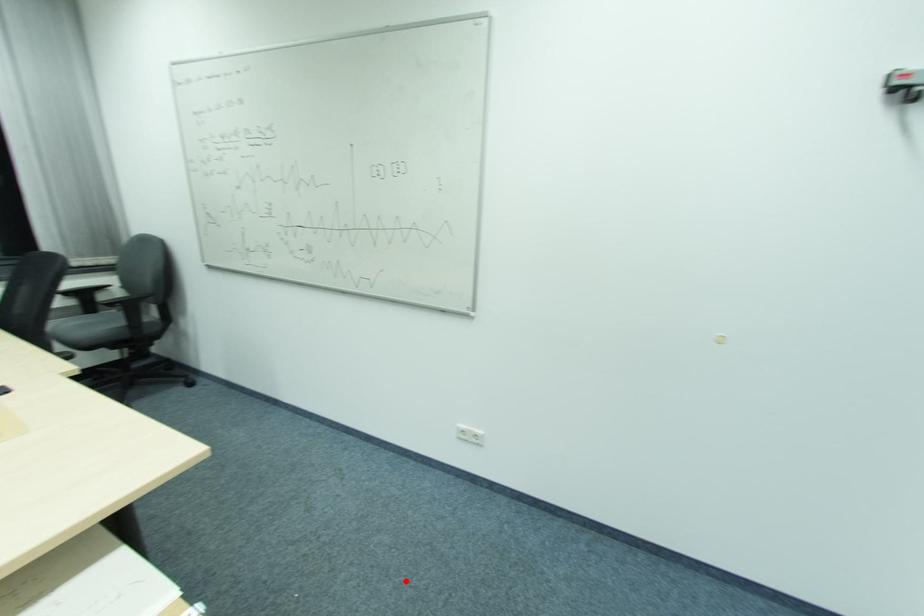
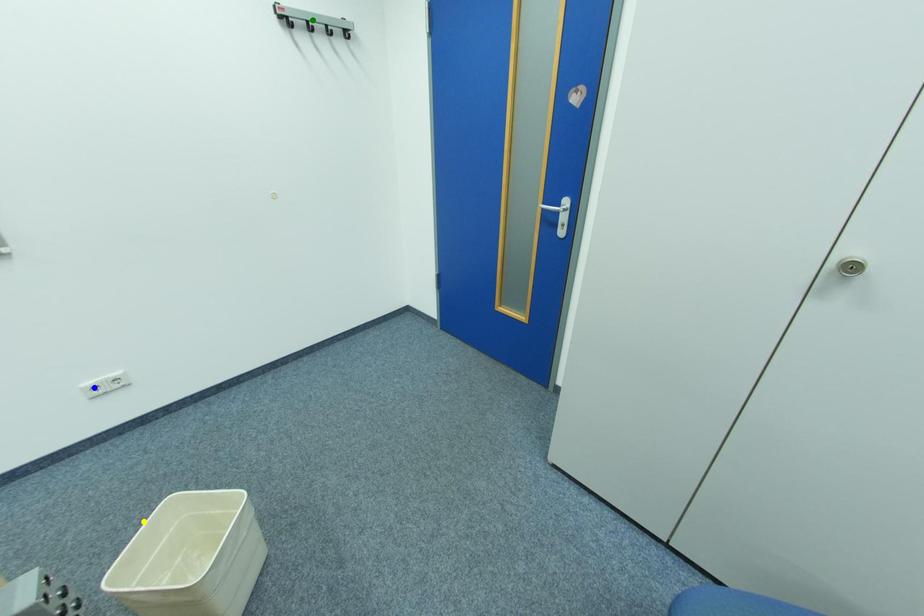
Question: I am providing you with two images of the same scene from different viewpoints. A red point is marked on the first image. You are given multiple points on the second image. Which point in image 2 represents the same 3d spot as the red point in image 1?

Choices:
 (A) green point
 (B) blue point
 (C) yellow point

Answer: (C)